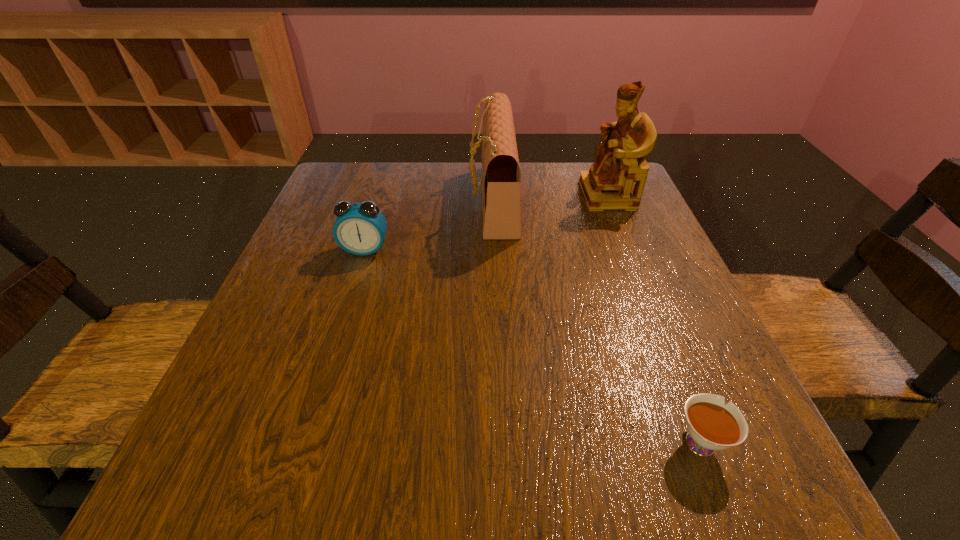
In order to click on object that is at the left edge in this screenshot , I will do `click(360, 228)`.

This screenshot has height=540, width=960. I want to click on figurine present at the right edge, so [x=620, y=161].

Locate an element on the screen. The image size is (960, 540). teacup present at the right edge is located at coordinates (712, 425).

I want to click on object at the far right corner, so click(620, 161).

You are a GUI agent. You are given a task and a screenshot of the screen. Output one action in this format:
    pyautogui.click(x=<x>, y=<y>)
    Task: Click on the object that is at the near right corner
    Image resolution: width=960 pixels, height=540 pixels.
    Given the screenshot: What is the action you would take?
    pyautogui.click(x=712, y=425)

In the image, there is a desktop. Where is `blank space at the far edge`? The height and width of the screenshot is (540, 960). blank space at the far edge is located at coordinates (455, 200).

In the image, there is a desktop. In order to click on blank space at the near edge in this screenshot , I will do `click(627, 468)`.

This screenshot has width=960, height=540. In order to click on vacant space at the left edge of the desktop in this screenshot , I will do `click(246, 360)`.

The image size is (960, 540). I want to click on vacant space at the right edge of the desktop, so click(585, 227).

This screenshot has width=960, height=540. What are the coordinates of `vacant area at the far left corner of the desktop` in the screenshot? It's located at (362, 195).